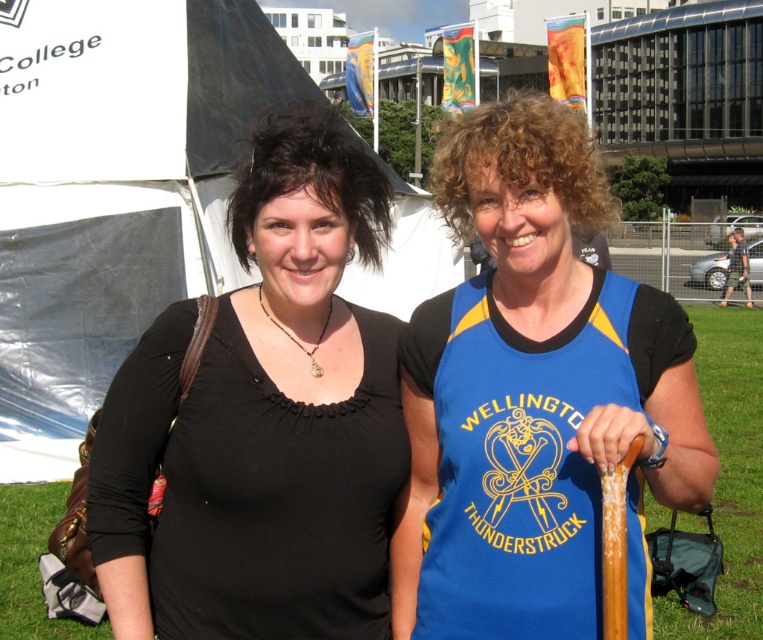
Which is more to the left, blue jersey at center or green grass at lower left?

green grass at lower left

Locate an element on the screen. blue jersey at center is located at coordinates (533, 394).

Does point (452, 561) come behind point (5, 512)?

No, it is not.

In order to click on blue jersey at center in this screenshot , I will do `click(533, 394)`.

Which is more to the left, blue jersey at center or black matte shirt at center?

From the viewer's perspective, black matte shirt at center appears more on the left side.

Describe the element at coordinates (533, 394) in the screenshot. The height and width of the screenshot is (640, 763). I see `blue jersey at center` at that location.

Does point (501, 340) come farther from viewer compared to point (301, 628)?

Yes, point (501, 340) is farther from viewer.

The image size is (763, 640). I want to click on blue jersey at center, so click(x=533, y=394).

Who is higher up, blue jersey at center or white fabric tent at upper left?

Positioned higher is white fabric tent at upper left.

Is blue jersey at center wider than white fabric tent at upper left?

In fact, blue jersey at center might be narrower than white fabric tent at upper left.

The height and width of the screenshot is (640, 763). Identify the location of blue jersey at center. (533, 394).